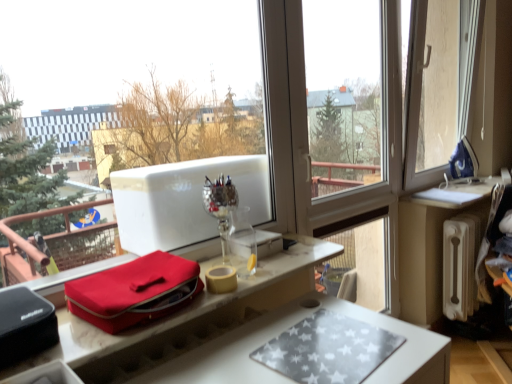
Find the location of a particular element. This screenshot has width=512, height=384. free space to the right of silver reflective wine glass at center is located at coordinates (273, 266).